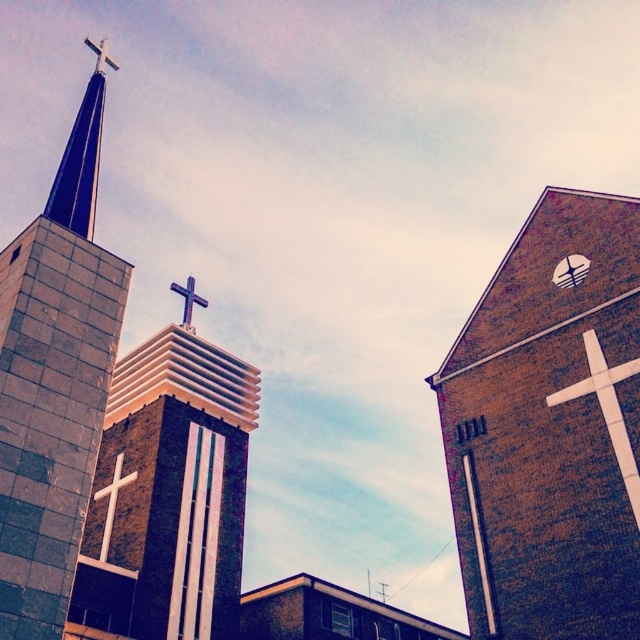
Question: Is white brick cross at upper center wider than white marble cross at center?

Choices:
 (A) yes
 (B) no

Answer: (B)

Question: Which object is farther from the camera taking this photo?

Choices:
 (A) white marble cross at center
 (B) white brick cross at upper center
 (C) white matte cross at upper left
 (D) metallic clock face at upper right

Answer: (C)

Question: Does white brick cross at upper center appear on the right side of white marble cross at center?

Choices:
 (A) yes
 (B) no

Answer: (A)

Question: Can you confirm if blue glossy spire at upper left is smaller than metallic clock face at upper right?

Choices:
 (A) yes
 (B) no

Answer: (B)

Question: Which is nearer to the blue glossy spire at upper left?

Choices:
 (A) white marble cross at center
 (B) white brick cross at upper center

Answer: (A)

Question: Estimate the real-world distances between objects in this image. Which object is farther from the white brick cross at upper center?

Choices:
 (A) metallic cross at center
 (B) white marble cross at center

Answer: (A)